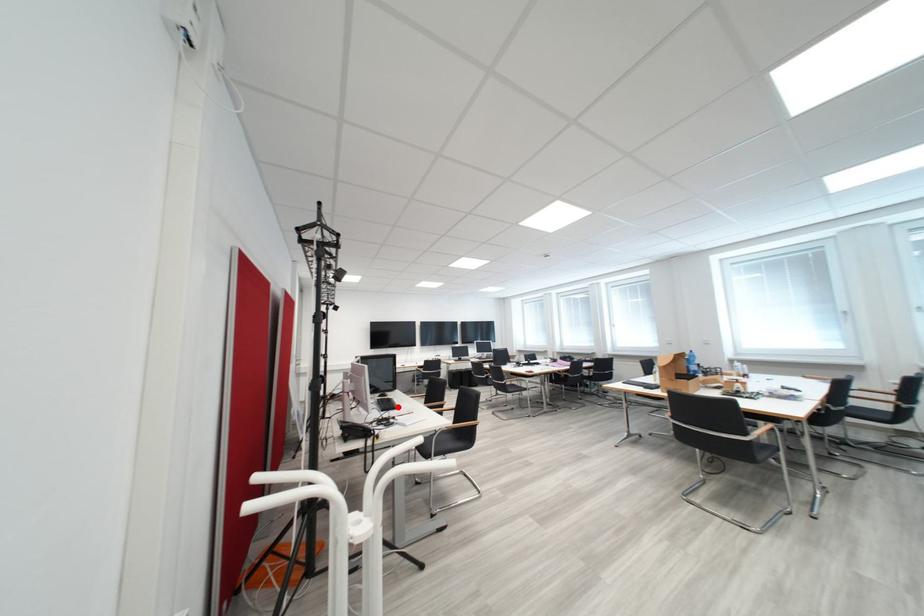
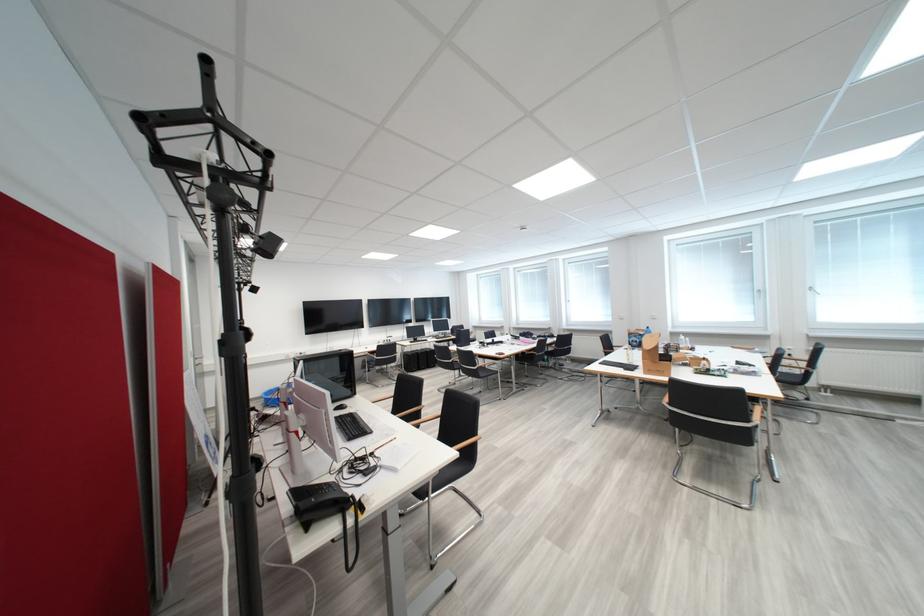
Where in the second image is the point corresponding to the highlighted location from the first image?

(365, 430)